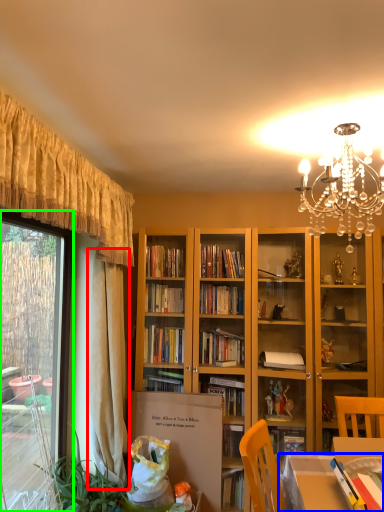
Question: Which object is positioned closest to curtain (highlighted by a red box)? Select from table (highlighted by a blue box) and window (highlighted by a green box).

Choices:
 (A) table
 (B) window

Answer: (B)